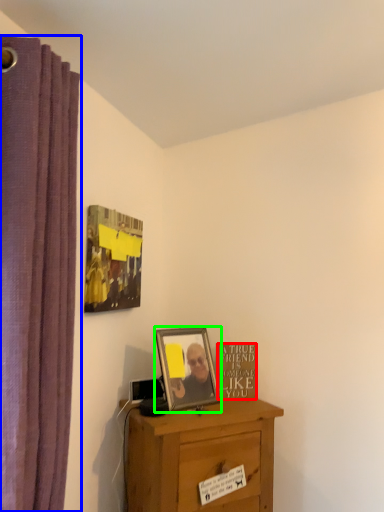
Question: Which object is the farthest from writing (highlighted by a red box)? Choose among these: curtain (highlighted by a blue box) or picture frame (highlighted by a green box).

Choices:
 (A) curtain
 (B) picture frame

Answer: (A)